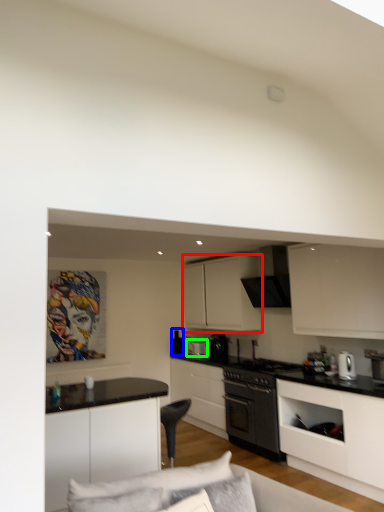
Question: Considering the real-world distances, which object is closest to cabinetry (highlighted by a red box)? appliance (highlighted by a blue box) or appliance (highlighted by a green box).

Choices:
 (A) appliance
 (B) appliance

Answer: (B)